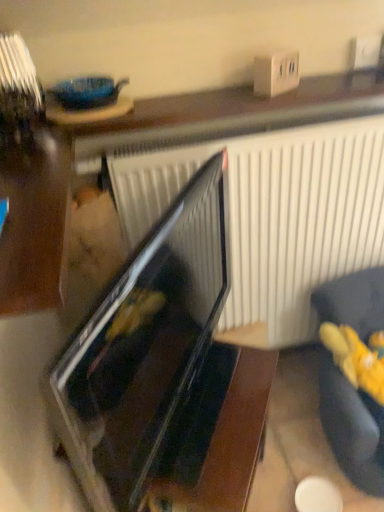
Question: Considering the relative positions of yellow plush toy at lower right and dark fabric couch at lower right in the image provided, is yellow plush toy at lower right to the left or to the right of dark fabric couch at lower right?

Choices:
 (A) left
 (B) right

Answer: (A)

Question: Looking at the image, does yellow plush toy at lower right seem bigger or smaller compared to dark fabric couch at lower right?

Choices:
 (A) big
 (B) small

Answer: (B)

Question: Which object is positioned farthest from the black glossy oven at center?

Choices:
 (A) dark fabric couch at lower right
 (B) yellow plush toy at lower right

Answer: (B)

Question: Considering the real-world distances, which object is closest to the yellow plush toy at lower right?

Choices:
 (A) dark fabric couch at lower right
 (B) black glossy oven at center

Answer: (A)